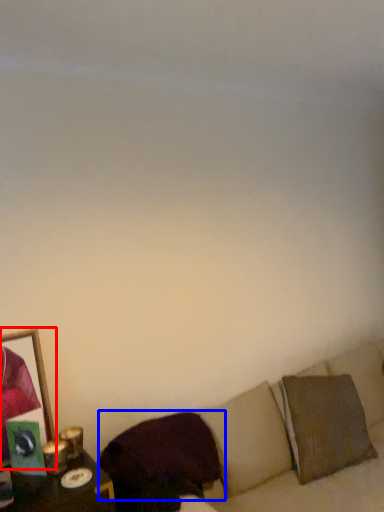
Question: Among these objects, which one is nearest to the camera, picture frame (highlighted by a red box) or pillow (highlighted by a blue box)?

Choices:
 (A) picture frame
 (B) pillow

Answer: (B)